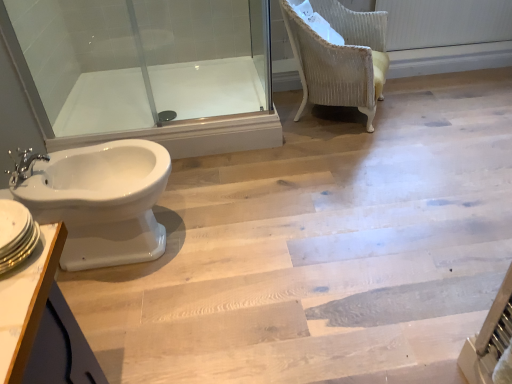
The height and width of the screenshot is (384, 512). Find the location of `free spot above white glossy bidet at left (from a real-world perspective)`. free spot above white glossy bidet at left (from a real-world perspective) is located at coordinates (354, 195).